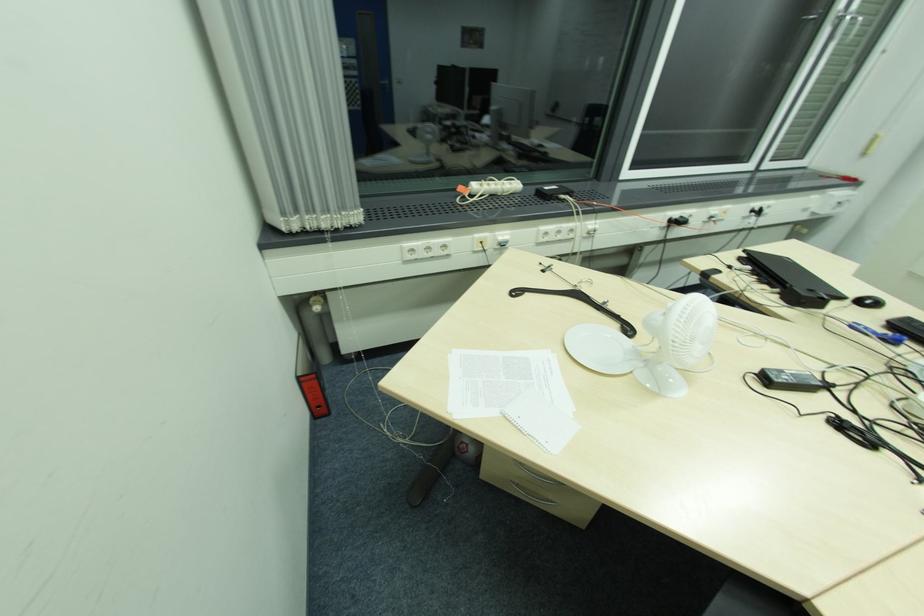
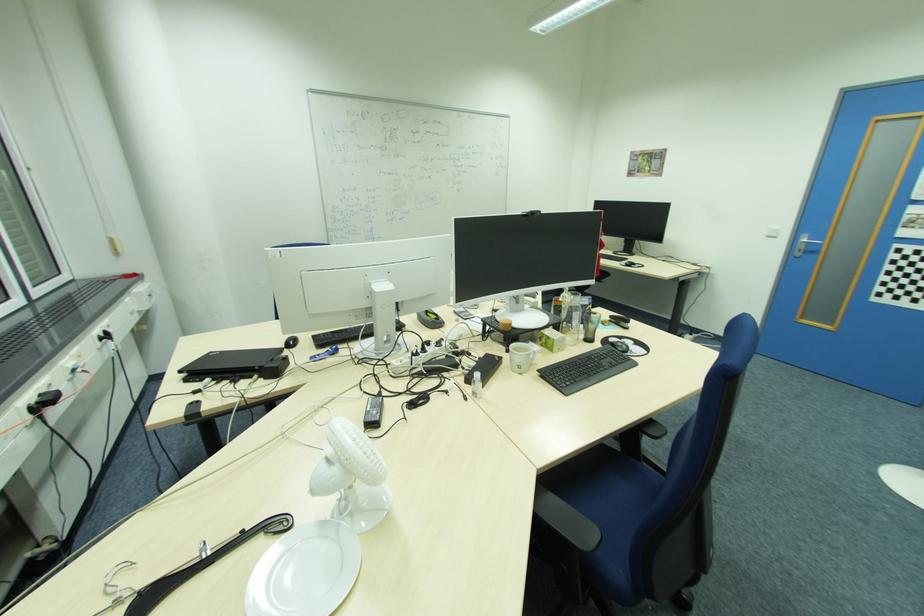
Locate, in the second image, the point that corresponds to pixel 869 302 in the first image.

(294, 344)